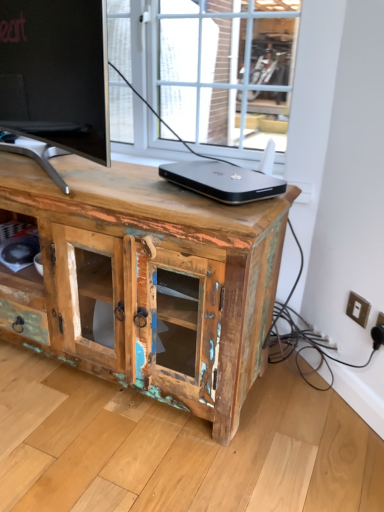
You are a GUI agent. You are given a task and a screenshot of the screen. Output one action in this format:
    pyautogui.click(x=<x>, y=<y>)
    Task: Click on the vacant space positioned to the left of sleek silver laptop at center
    This screenshot has height=512, width=384.
    Given the screenshot: What is the action you would take?
    pyautogui.click(x=124, y=181)